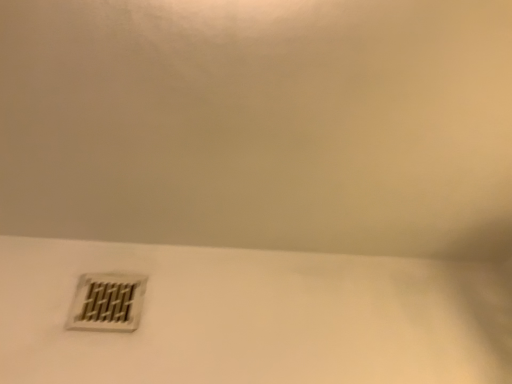
Locate an element on the screen. This screenshot has width=512, height=384. white plastic power plugs and sockets at lower left is located at coordinates (106, 302).

The width and height of the screenshot is (512, 384). What do you see at coordinates (106, 302) in the screenshot? I see `white plastic power plugs and sockets at lower left` at bounding box center [106, 302].

What is the approximate width of white plastic power plugs and sockets at lower left?

white plastic power plugs and sockets at lower left is 0.65 inches in width.

Find the location of `white plastic power plugs and sockets at lower left`. white plastic power plugs and sockets at lower left is located at coordinates (106, 302).